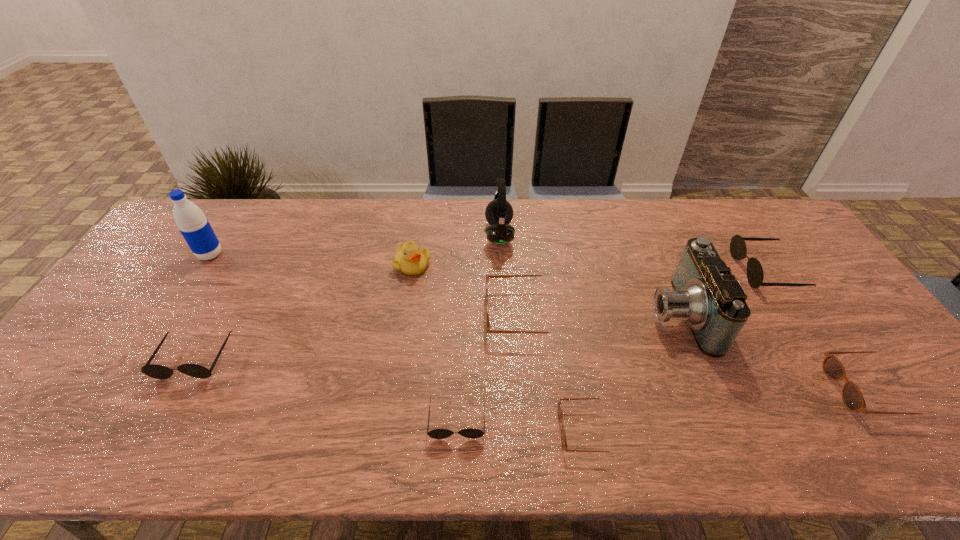
Find the location of a particular element. The image size is (960, 540). blue water bottle is located at coordinates point(195,228).

At what (x,y) coordinates should I click in order to perform the action: click on water bottle. Please return your answer as a coordinate pair (x, y). This screenshot has height=540, width=960. Looking at the image, I should click on (195, 228).

The height and width of the screenshot is (540, 960). In order to click on headset in this screenshot , I will do `click(499, 213)`.

What are the coordinates of `blue camcorder` in the screenshot? It's located at click(x=706, y=295).

Find the location of a particular element. Image resolution: width=960 pixels, height=540 pixels. camcorder is located at coordinates (706, 295).

You are a GUI agent. You are given a task and a screenshot of the screen. Output one action in this format:
    pyautogui.click(x=<x>, y=<y>)
    Task: Click on the third object from left to right
    
    Given the screenshot: What is the action you would take?
    pyautogui.click(x=409, y=259)

Identify the location of duckling. (409, 259).

Identify the location of the farthest black sunglasses. (738, 250).

Find the location of a particular element. Image resolution: width=960 pixels, height=540 pixels. the biggest black sunglasses is located at coordinates (738, 250).

Identify the location of the biggest brown sunglasses. (488, 330).